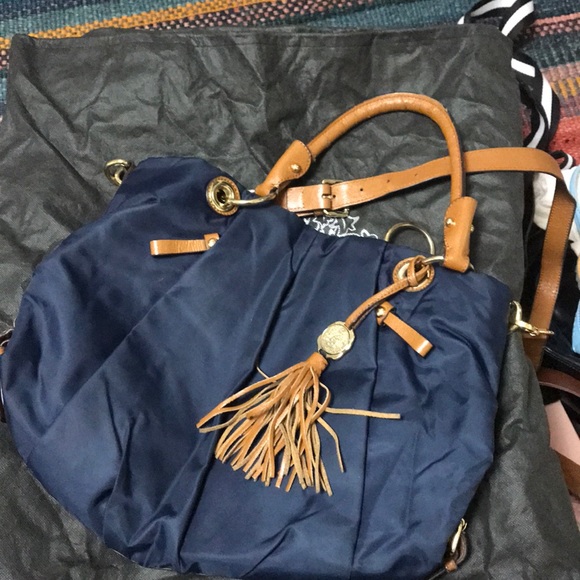
The height and width of the screenshot is (580, 580). In order to click on tassel in this screenshot , I will do `click(271, 418)`.